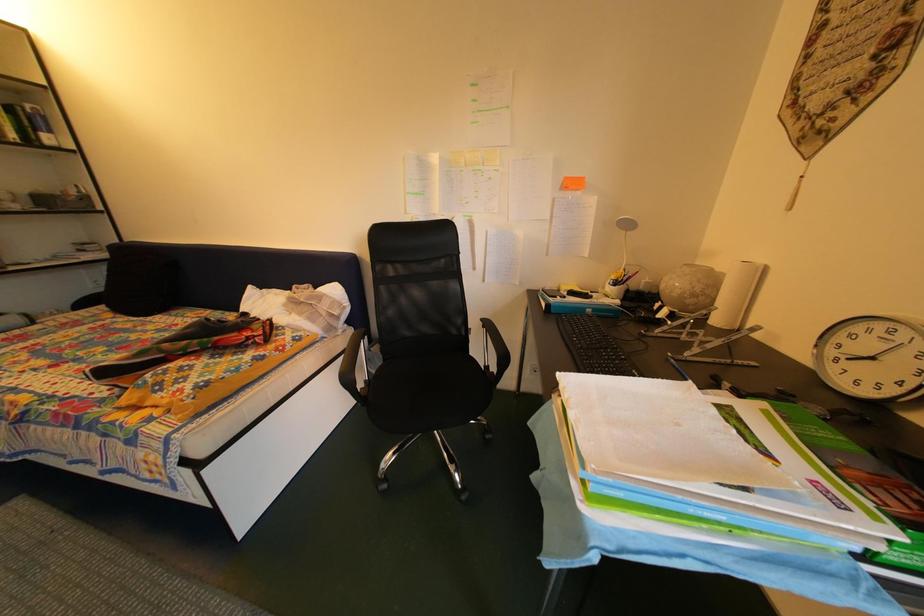
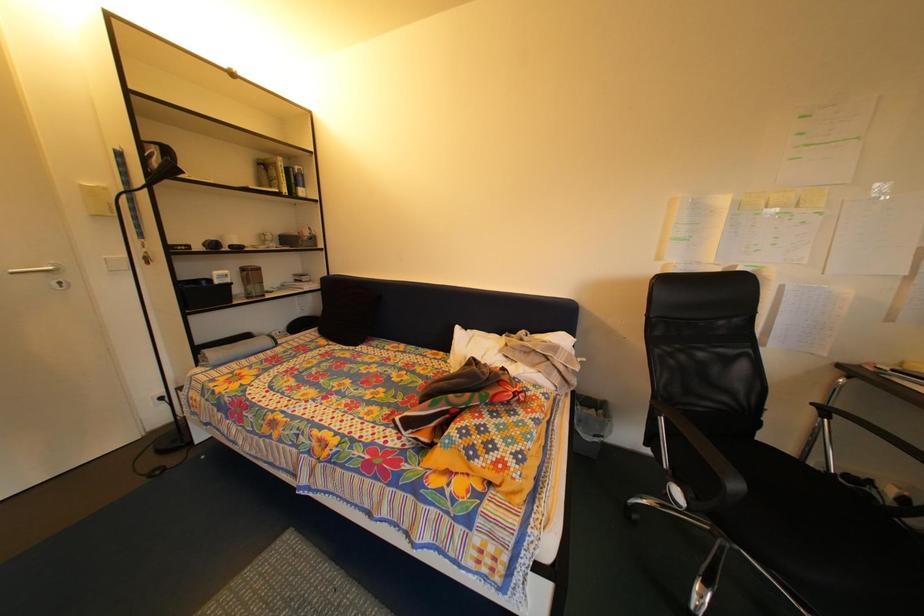
Question: In a continuous first-person perspective shot, in which direction is the camera moving?

Choices:
 (A) Left
 (B) Right
 (C) Forward
 (D) Backward

Answer: (A)